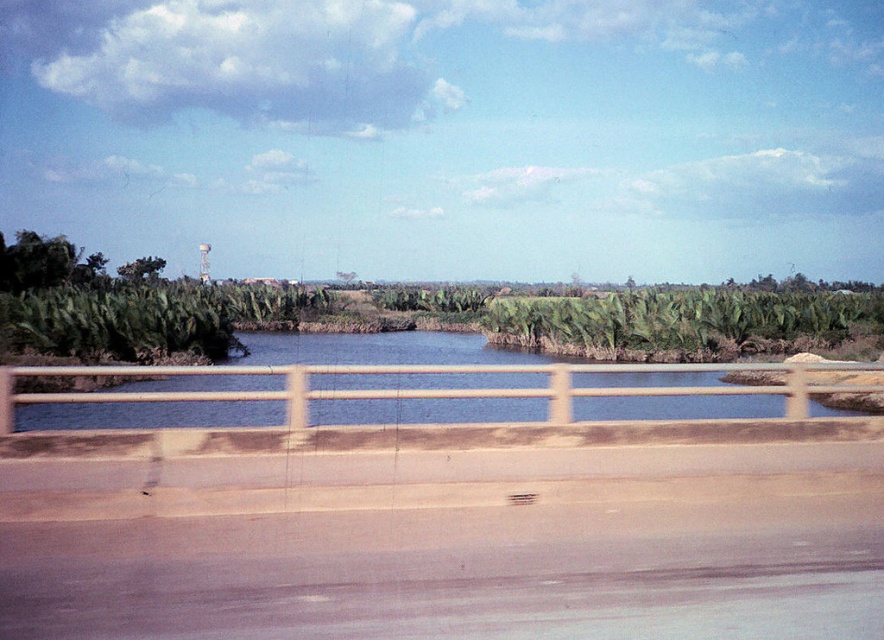
You are standing at the center of the bridge and want to reach a point marked at coordinate (156, 417). Given that the bridge is 100 feet long, can you estimate how far you need to walk to reach that point?

The point at coordinate (156, 417) is 50.12 feet away from the viewer, so you need to walk approximately 50 feet to reach it.

You are a passenger in a car driving past this landscape. You notice the blue water at center and the green leafy tree at upper left. Which object is positioned lower in the scene?

The blue water at center is positioned lower than the green leafy tree at upper left.